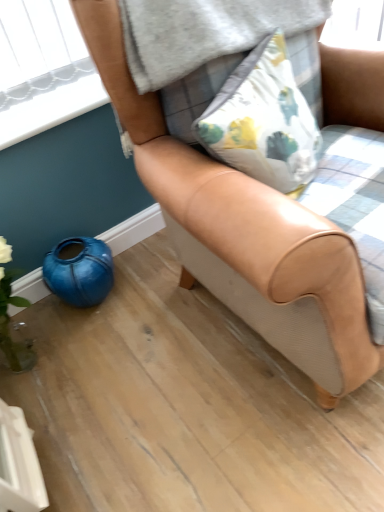
Question: Should I look upward or downward to see tan leather chair at center?

Choices:
 (A) down
 (B) up

Answer: (B)